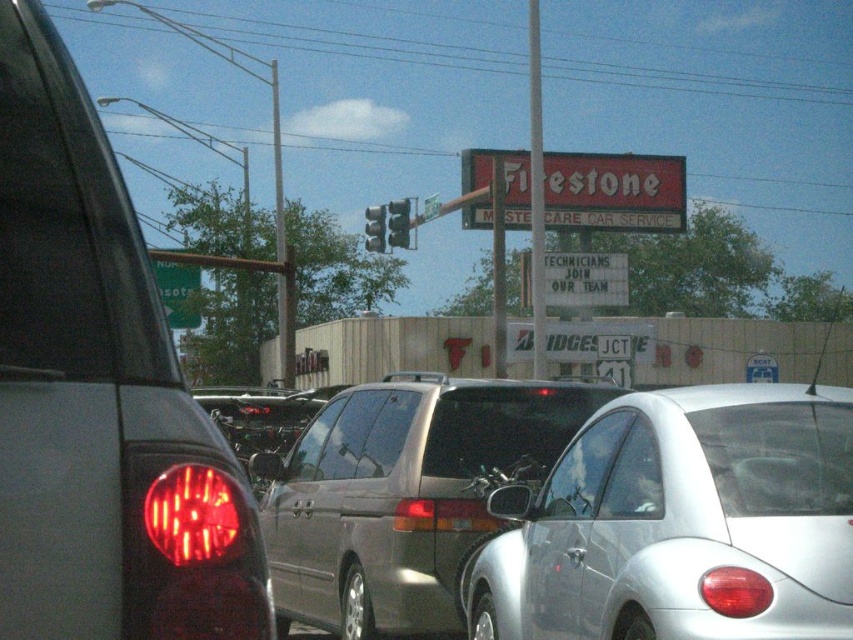
You are a pedestrian standing at the crosswalk near the metallic silver traffic light at center. You want to cross the street to reach the silver metallic car at center parked on the other side. The crosswalk is 30 feet wide. Can you safely cross without needing to walk further than the crosswalk?

The silver metallic car at center is 50.17 feet away from the metallic silver traffic light at center. Since the crosswalk is only 30 feet wide, you would need to walk an additional 20.17 feet beyond the crosswalk to reach the car, so it is not safe to cross without going beyond the crosswalk.

You are a driver looking at the traffic ahead. You notice a silver metallic car at center and a black plastic license plate at center. Which object is positioned to the right side?

The silver metallic car at center is to the right of the black plastic license plate at center.